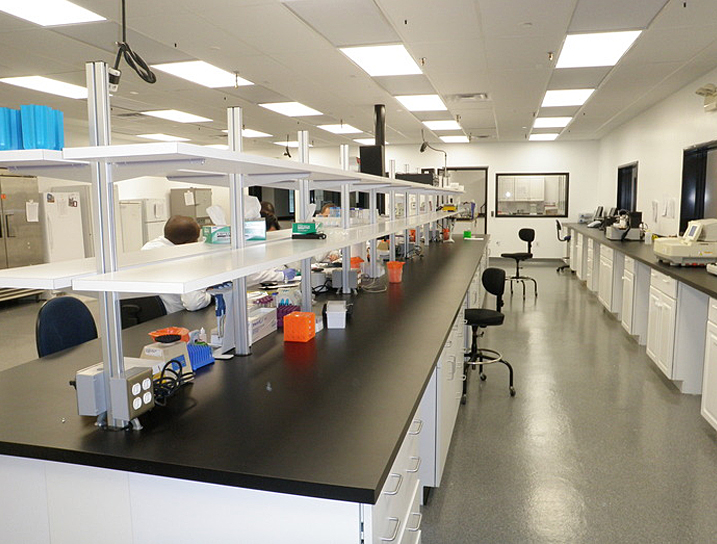
Locate an element on the screen. This screenshot has width=717, height=544. ceiling is located at coordinates (473, 50).